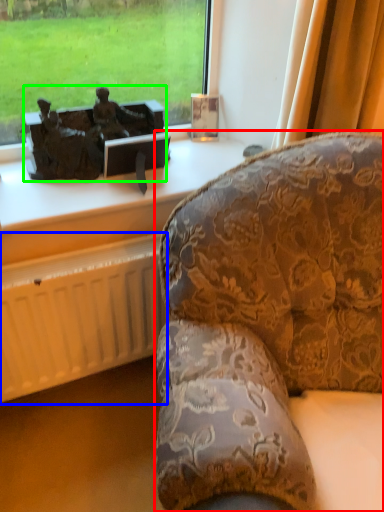
Question: Which object is positioned closest to studio couch (highlighted by a red box)? Select from radiator (highlighted by a blue box) and antique (highlighted by a green box).

Choices:
 (A) radiator
 (B) antique

Answer: (A)